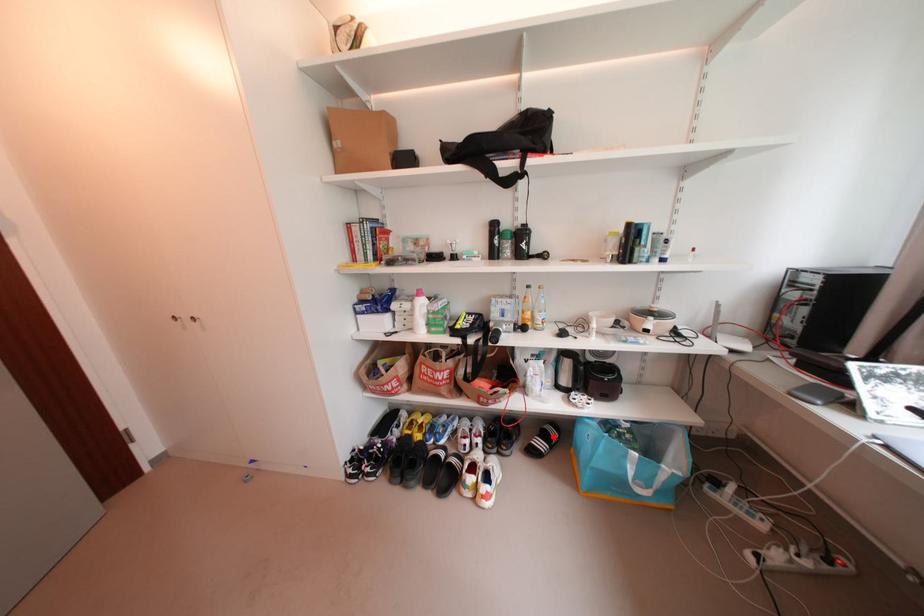
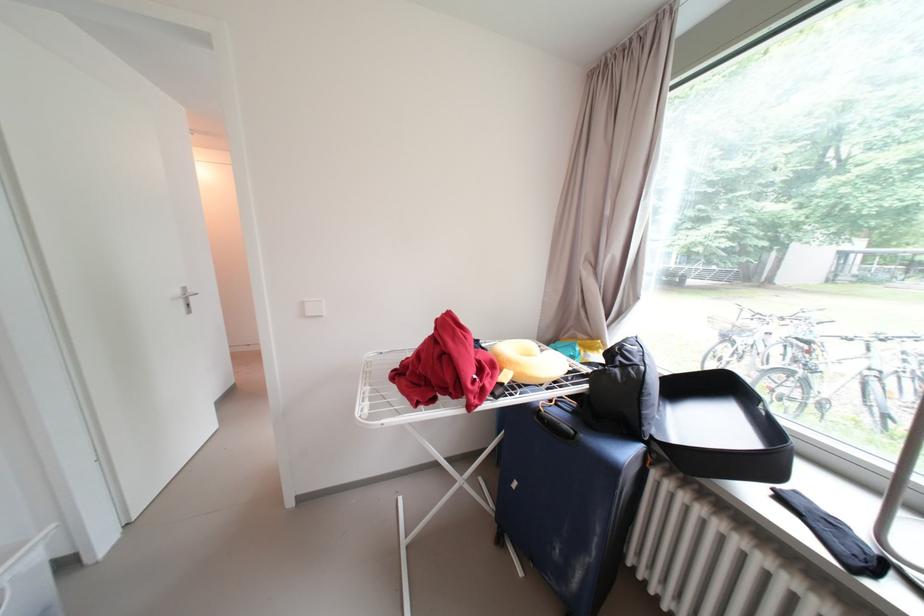
Question: I am providing you with two images of the same scene from different viewpoints. A red point is marked on the first image. At the location where the point appears in image 1, is it still visible in image 2?

Choices:
 (A) Yes
 (B) No

Answer: (B)